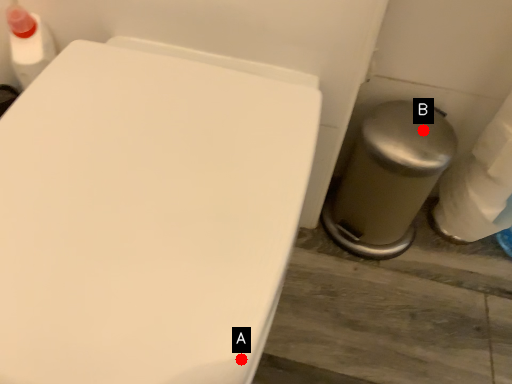
Question: Two points are circled on the image, labeled by A and B beside each circle. Which point is closer to the camera?

Choices:
 (A) A is closer
 (B) B is closer

Answer: (A)